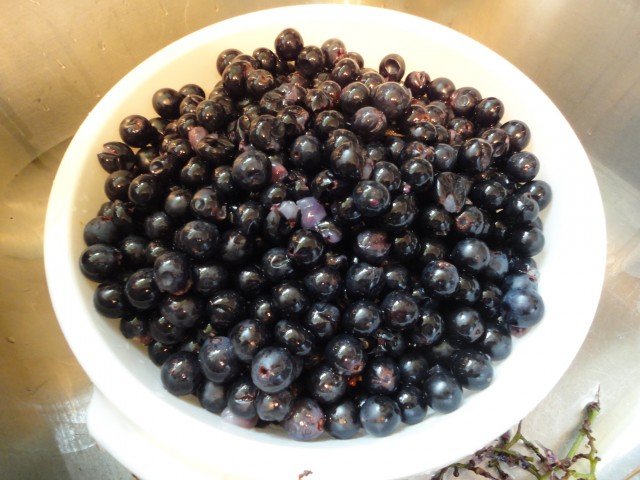
You are a GUI agent. You are given a task and a screenshot of the screen. Output one action in this format:
    pyautogui.click(x=<x>, y=<y>)
    Task: Click on the bowl of blueberries
    The width and height of the screenshot is (640, 480).
    Given the screenshot: What is the action you would take?
    pyautogui.click(x=326, y=227)